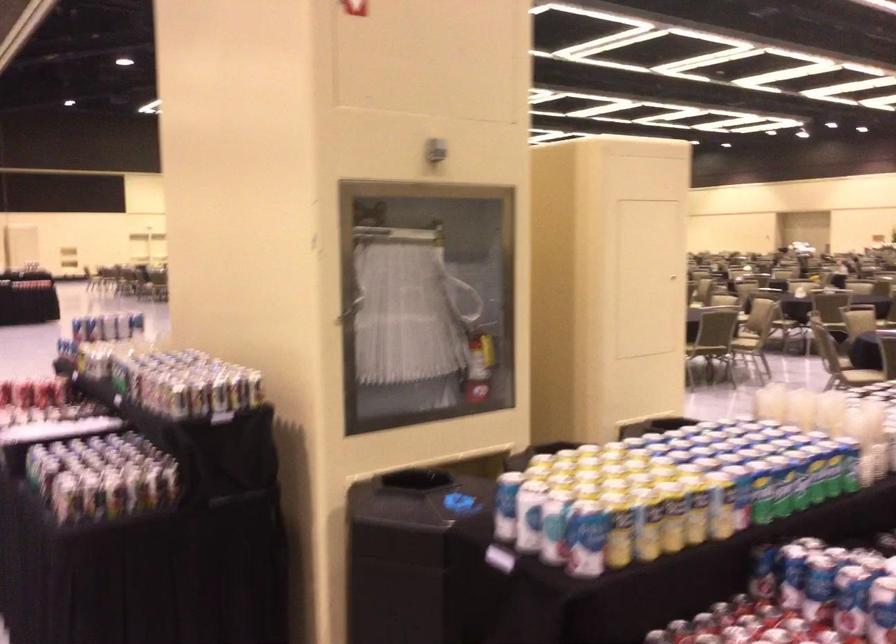
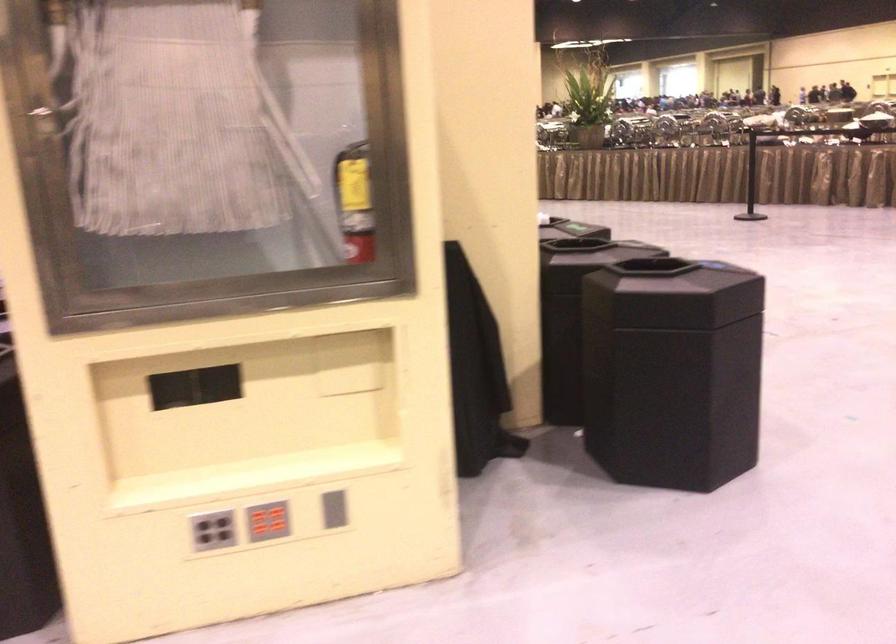
Question: I am providing you with two images of the same scene from different viewpoints. After the viewpoint changes to image2, which objects are now occluded?

Choices:
 (A) clear glass dish
 (B) grey button panel
 (C) cabinet door handle
 (D) black trash can lid

Answer: (C)